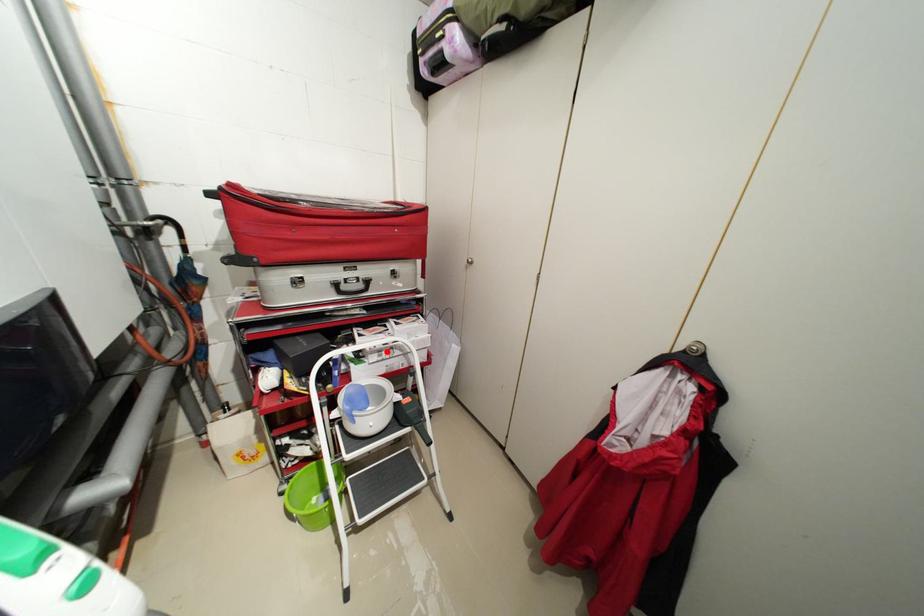
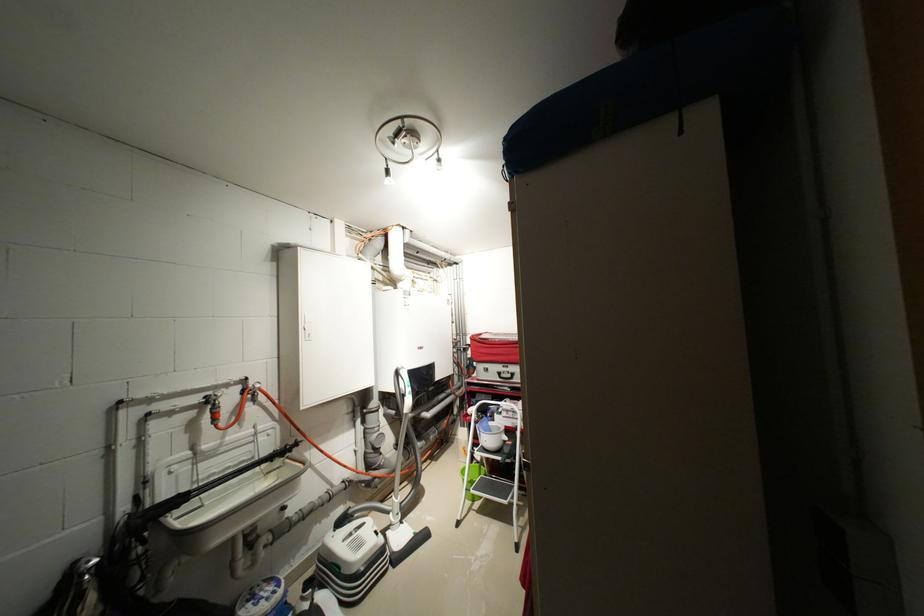
Question: I am providing you with two images of the same scene from different viewpoints. In image1, a red point is highlighted. Considering the same 3D point in image2, which of the following is correct?

Choices:
 (A) It is closer
 (B) It is farther

Answer: (B)